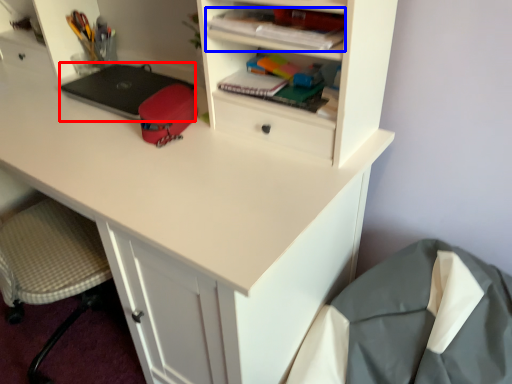
Question: Which of the following is the closest to the observer, laptop (highlighted by a red box) or book (highlighted by a blue box)?

Choices:
 (A) laptop
 (B) book

Answer: (B)